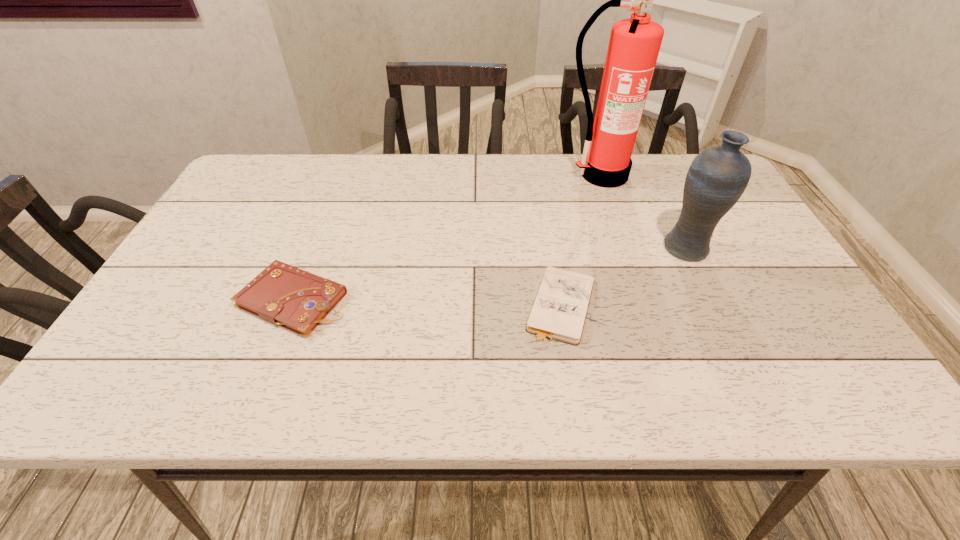
The height and width of the screenshot is (540, 960). I want to click on vacant area that lies between the shorter notebook and the taller notebook, so click(x=427, y=302).

The height and width of the screenshot is (540, 960). In order to click on empty space that is in between the third tallest object and the vase in this screenshot , I will do `click(491, 274)`.

You are a GUI agent. You are given a task and a screenshot of the screen. Output one action in this format:
    pyautogui.click(x=<x>, y=<y>)
    Task: Click on the free space between the vase and the right notebook
    
    Given the screenshot: What is the action you would take?
    tap(623, 276)

Identify the location of free point between the fire extinguisher and the right notebook. (581, 240).

This screenshot has width=960, height=540. I want to click on free space between the second shortest object and the shorter notebook, so click(427, 302).

Find the location of `empty location between the second farthest object and the farthest object`. empty location between the second farthest object and the farthest object is located at coordinates (644, 211).

You are a GUI agent. You are given a task and a screenshot of the screen. Output one action in this format:
    pyautogui.click(x=<x>, y=<y>)
    Task: Click on the unoccupied area between the third tallest object and the vase
    This screenshot has height=540, width=960.
    Given the screenshot: What is the action you would take?
    pyautogui.click(x=491, y=274)

The image size is (960, 540). I want to click on free space that is in between the third nearest object and the leftmost object, so click(491, 274).

The width and height of the screenshot is (960, 540). I want to click on free point between the farthest object and the taller notebook, so click(x=447, y=238).

Find the location of `empty space between the right notebook and the left notebook`. empty space between the right notebook and the left notebook is located at coordinates (427, 302).